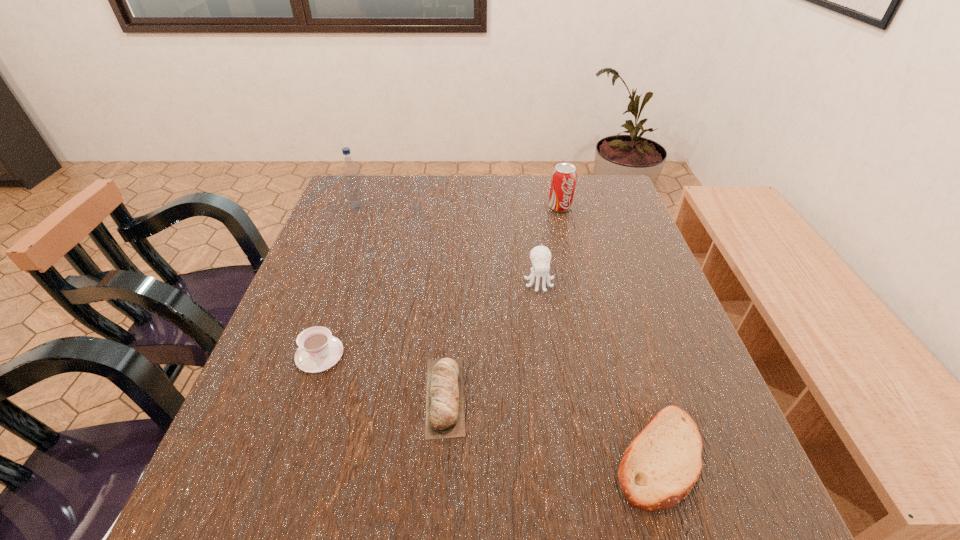
Locate an element on the screen. This screenshot has height=540, width=960. free space located 0.130m on the front of the fifth shortest object is located at coordinates (568, 241).

Locate an element on the screen. This screenshot has height=540, width=960. free space located 0.230m on the front-facing side of the third tallest object is located at coordinates coord(553,377).

Find the location of `vacant space located on the left of the third object from left to right`. vacant space located on the left of the third object from left to right is located at coordinates (261, 396).

Identify the location of free region located on the left of the shortest object. The height and width of the screenshot is (540, 960). (381, 456).

The height and width of the screenshot is (540, 960). What are the coordinates of `water bottle that is at the far edge` in the screenshot? It's located at (350, 171).

Find the location of a particular element. The width and height of the screenshot is (960, 540). soda can positioned at the far edge is located at coordinates (564, 176).

You are a GUI agent. You are given a task and a screenshot of the screen. Output one action in this format:
    pyautogui.click(x=<x>, y=<y>)
    Task: Click on the object positioned at the near edge
    The width and height of the screenshot is (960, 540).
    Given the screenshot: What is the action you would take?
    pyautogui.click(x=660, y=467)

At what (x,y) coordinates should I click in order to perform the action: click on water bottle that is at the left edge. Please return your answer as a coordinate pair (x, y). The height and width of the screenshot is (540, 960). Looking at the image, I should click on (350, 171).

You are a GUI agent. You are given a task and a screenshot of the screen. Output one action in this format:
    pyautogui.click(x=<x>, y=<y>)
    Task: Click on the teacup located at the left edge
    
    Given the screenshot: What is the action you would take?
    pyautogui.click(x=318, y=351)

Where is `soda can at the right edge`? soda can at the right edge is located at coordinates (564, 176).